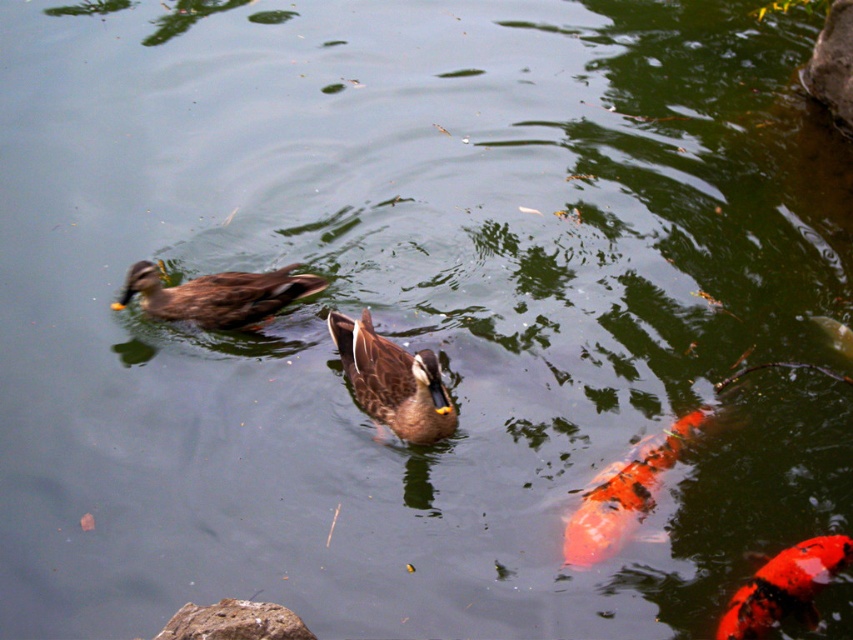
Question: Does brown matte duck at upper left come in front of shiny orange fish at lower right?

Choices:
 (A) no
 (B) yes

Answer: (A)

Question: Considering the real-world distances, which object is closest to the rough textured rock at lower left?

Choices:
 (A) brown matte duck at center
 (B) shiny orange fish at lower right
 (C) brown matte duck at upper left
 (D) orange and white scaled fish at lower right

Answer: (A)

Question: Is brown matte duck at center bigger than rough textured rock at lower left?

Choices:
 (A) yes
 (B) no

Answer: (A)

Question: Estimate the real-world distances between objects in this image. Which object is closer to the rough textured rock at lower left?

Choices:
 (A) brown matte duck at upper left
 (B) orange and white scaled fish at lower right
 (C) shiny orange fish at lower right
 (D) brown matte duck at center

Answer: (D)

Question: Which point is farther to the camera?

Choices:
 (A) brown matte duck at center
 (B) rough textured rock at lower left

Answer: (A)

Question: Is shiny orange fish at lower right in front of rough textured rock at lower left?

Choices:
 (A) no
 (B) yes

Answer: (A)